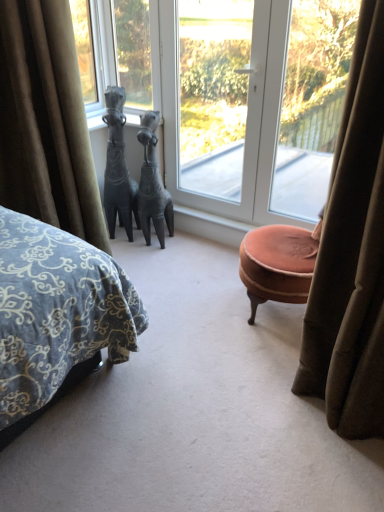
Image resolution: width=384 pixels, height=512 pixels. I want to click on transparent glass door at center, so click(x=213, y=94).

This screenshot has height=512, width=384. Describe the element at coordinates (213, 94) in the screenshot. I see `transparent glass door at center` at that location.

Describe the element at coordinates (312, 103) in the screenshot. This screenshot has width=384, height=512. I see `transparent glass window at upper right, the 3th window positioned from the left` at that location.

The width and height of the screenshot is (384, 512). What do you see at coordinates (153, 184) in the screenshot?
I see `bronze horse at center` at bounding box center [153, 184].

I want to click on transparent glass window at upper center, marked as the first window in a left-to-right arrangement, so click(134, 51).

Identify the location of transparent glass door at center, the second window positioned from the right. (260, 103).

Consider the image. Is transparent glass door at center to the right of transparent glass window at upper center, marked as the first window in a left-to-right arrangement, from the viewer's perspective?

Yes, transparent glass door at center is to the right of transparent glass window at upper center, marked as the first window in a left-to-right arrangement.

Between transparent glass door at center and transparent glass window at upper center, marked as the first window in a left-to-right arrangement, which one has less height?

With less height is transparent glass window at upper center, marked as the first window in a left-to-right arrangement.

Which is nearer, (182, 165) or (139, 51)?

The point (139, 51) is in front.

From the image's perspective, which object appears higher, transparent glass door at center or transparent glass window at upper center, marked as the first window in a left-to-right arrangement?

transparent glass window at upper center, marked as the first window in a left-to-right arrangement, is shown above in the image.

Looking at this image, is transparent glass window at upper right, the 3th window positioned from the left, facing away from transparent glass door at center?

No.

Does point (314, 97) lie in front of point (245, 110)?

That is True.

Measure the distance between transparent glass window at upper right, marked as the 1th window in a right-to-left arrangement, and transparent glass door at center.

transparent glass window at upper right, marked as the 1th window in a right-to-left arrangement, and transparent glass door at center are 19.66 inches apart.

From the image's perspective, starting from the velvet brown curtain at left, which window is the 1st one above? Please provide its 2D coordinates.

[(312, 103)]

Considering the sizes of objects transparent glass window at upper right, marked as the 1th window in a right-to-left arrangement, and velvet brown curtain at left in the image provided, who is smaller, transparent glass window at upper right, marked as the 1th window in a right-to-left arrangement, or velvet brown curtain at left?

Smaller between the two is transparent glass window at upper right, marked as the 1th window in a right-to-left arrangement.

Between transparent glass window at upper right, marked as the 1th window in a right-to-left arrangement, and velvet brown curtain at left, which one appears on the left side from the viewer's perspective?

Positioned to the left is velvet brown curtain at left.

From the picture: Is transparent glass window at upper right, the 3th window positioned from the left, oriented towards velvet brown curtain at left?

No, transparent glass window at upper right, the 3th window positioned from the left, is not oriented towards velvet brown curtain at left.

Is bronze horse at center positioned beyond the bounds of transparent glass window at upper center, marked as the first window in a left-to-right arrangement?

bronze horse at center is positioned outside transparent glass window at upper center, marked as the first window in a left-to-right arrangement.

From the image's perspective, is bronze horse at center below transparent glass window at upper center, acting as the 3th window starting from the right?

Yes, from the image's perspective, bronze horse at center is beneath transparent glass window at upper center, acting as the 3th window starting from the right.

Who is shorter, bronze horse at center or transparent glass window at upper center, marked as the first window in a left-to-right arrangement?

Standing shorter between the two is transparent glass window at upper center, marked as the first window in a left-to-right arrangement.

Can you tell me how much bronze horse at center and transparent glass window at upper center, acting as the 3th window starting from the right, differ in facing direction?

20.1 degrees separate the facing orientations of bronze horse at center and transparent glass window at upper center, acting as the 3th window starting from the right.

Locate an element on the screen. window that is the 2nd one above the transparent glass door at center, the second window positioned from the right (from a real-world perspective) is located at coordinates (x=134, y=51).

Which object is positioned more to the right, transparent glass door at center, marked as the 2th window in a left-to-right arrangement, or transparent glass window at upper center, acting as the 3th window starting from the right?

transparent glass door at center, marked as the 2th window in a left-to-right arrangement.

Is point (127, 94) behind point (147, 88)?

Yes, point (127, 94) is behind point (147, 88).

Considering their positions, is transparent glass door at center, the second window positioned from the right, located in front of or behind transparent glass window at upper center, marked as the first window in a left-to-right arrangement?

transparent glass door at center, the second window positioned from the right, is in front of transparent glass window at upper center, marked as the first window in a left-to-right arrangement.

Is transparent glass door at center oriented away from bronze horse at center?

Yes, transparent glass door at center is facing away from bronze horse at center.

Where is `window screen above the bronze horse at center (from the image's perspective)`? Image resolution: width=384 pixels, height=512 pixels. window screen above the bronze horse at center (from the image's perspective) is located at coordinates (213, 94).

Which point is more forward, (219, 193) or (150, 243)?

The point (150, 243) is closer to the camera.

From the image's perspective, does transparent glass door at center appear lower than bronze horse at center?

No, from the image's perspective, transparent glass door at center is not beneath bronze horse at center.

Is transparent glass door at center taller or shorter than transparent glass window at upper right, the 3th window positioned from the left?

Considering their sizes, transparent glass door at center has more height than transparent glass window at upper right, the 3th window positioned from the left.

Which is in front, transparent glass door at center or transparent glass window at upper right, marked as the 1th window in a right-to-left arrangement?

transparent glass window at upper right, marked as the 1th window in a right-to-left arrangement.

Based on their sizes in the image, would you say transparent glass door at center is bigger or smaller than transparent glass window at upper right, the 3th window positioned from the left?

transparent glass door at center is bigger than transparent glass window at upper right, the 3th window positioned from the left.

This screenshot has height=512, width=384. There is a transparent glass door at center. In order to click on the 3rd window above it (from a real-world perspective) in this screenshot , I will do `click(134, 51)`.

Locate an element on the screen. The image size is (384, 512). window that is the 2nd object located in front of the transparent glass door at center is located at coordinates (312, 103).

When comparing their distances from transparent glass door at center, does transparent glass window at upper right, the 3th window positioned from the left, or black stone horse at center seem further?

Among the two, black stone horse at center is located further to transparent glass door at center.

From the image, which object appears to be nearer to transparent glass window at upper right, marked as the 1th window in a right-to-left arrangement, black stone horse at center or transparent glass door at center, the second window positioned from the right?

Based on the image, transparent glass door at center, the second window positioned from the right, appears to be nearer to transparent glass window at upper right, marked as the 1th window in a right-to-left arrangement.

When comparing their distances from transparent glass window at upper right, marked as the 1th window in a right-to-left arrangement, does bronze horse at center or transparent glass door at center seem closer?

The object closer to transparent glass window at upper right, marked as the 1th window in a right-to-left arrangement, is transparent glass door at center.

Estimate the real-world distances between objects in this image. Which object is closer to bronze horse at center, velvet brown curtain at left or transparent glass window at upper right, the 3th window positioned from the left?

velvet brown curtain at left is closer to bronze horse at center.

Based on their spatial positions, is transparent glass door at center, marked as the 2th window in a left-to-right arrangement, or velvet brown curtain at left further from black stone horse at center?

transparent glass door at center, marked as the 2th window in a left-to-right arrangement.

Considering their positions, is bronze horse at center positioned further to transparent glass door at center, the second window positioned from the right, than transparent glass window at upper right, marked as the 1th window in a right-to-left arrangement?

bronze horse at center is further to transparent glass door at center, the second window positioned from the right.

Estimate the real-world distances between objects in this image. Which object is further from transparent glass door at center, transparent glass door at center, the second window positioned from the right, or velvet brown curtain at left?

Based on the image, velvet brown curtain at left appears to be further to transparent glass door at center.

Estimate the real-world distances between objects in this image. Which object is closer to transparent glass window at upper center, acting as the 3th window starting from the right, transparent glass window at upper right, the 3th window positioned from the left, or transparent glass door at center?

transparent glass door at center.

Where is `animal between transparent glass window at upper center, marked as the first window in a left-to-right arrangement, and transparent glass window at upper right, the 3th window positioned from the left`? animal between transparent glass window at upper center, marked as the first window in a left-to-right arrangement, and transparent glass window at upper right, the 3th window positioned from the left is located at coordinates (153, 184).

Find the location of a particular element. This screenshot has width=384, height=512. window screen situated between bronze horse at center and transparent glass door at center, the second window positioned from the right, from left to right is located at coordinates (213, 94).

Where is `window between bronze horse at center and transparent glass window at upper right, the 3th window positioned from the left`? This screenshot has width=384, height=512. window between bronze horse at center and transparent glass window at upper right, the 3th window positioned from the left is located at coordinates (260, 103).

Locate an element on the screen. animal between black stone horse at center and transparent glass door at center in the horizontal direction is located at coordinates (153, 184).